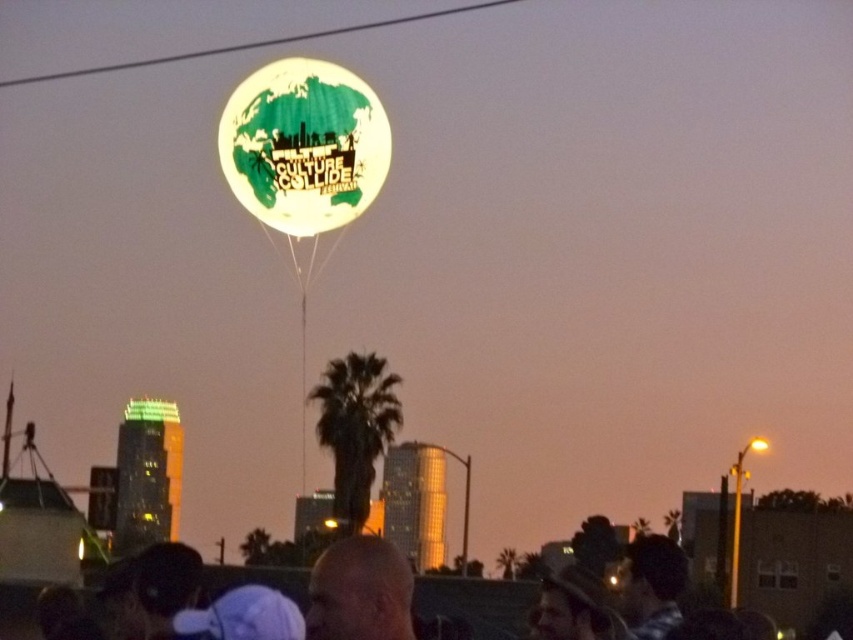
Question: Which object appears farthest from the camera in this image?

Choices:
 (A) bald head at upper center
 (B) translucent white balloon at center

Answer: (A)

Question: Is translucent white balloon at center to the right of bald head at upper center from the viewer's perspective?

Choices:
 (A) yes
 (B) no

Answer: (B)

Question: Which point is farther from the camera taking this photo?

Choices:
 (A) tap(376, 572)
 (B) tap(318, 29)

Answer: (B)

Question: Among these points, which one is nearest to the camera?

Choices:
 (A) (347, 33)
 (B) (274, 138)
 (C) (364, 636)

Answer: (B)

Question: Is translucent white balloon at center positioned at the back of green matte balloon at upper center?

Choices:
 (A) yes
 (B) no

Answer: (B)

Question: Is bald head at upper center to the left of green matte balloon at upper center from the viewer's perspective?

Choices:
 (A) no
 (B) yes

Answer: (A)